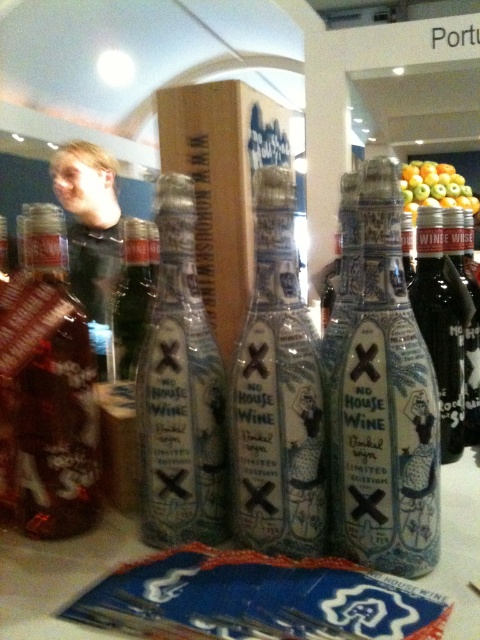
Question: Among these objects, which one is nearest to the camera?

Choices:
 (A) white paper bottle at center
 (B) matte black bottle at center
 (C) translucent glass bottle at center

Answer: (A)

Question: Among these objects, which one is nearest to the camera?

Choices:
 (A) translucent glass bottle at center
 (B) white paper bottle at center
 (C) matte black bottle at center

Answer: (B)

Question: Does black glass bottle at right appear on the left side of matte glass bottle at center?

Choices:
 (A) no
 (B) yes

Answer: (A)

Question: Can you confirm if translucent glass bottle at center is wider than black glass bottle at right?

Choices:
 (A) no
 (B) yes

Answer: (A)

Question: Considering the relative positions of white paper bottle at center and black glass bottle at right in the image provided, where is white paper bottle at center located with respect to black glass bottle at right?

Choices:
 (A) below
 (B) above

Answer: (A)

Question: Among these objects, which one is nearest to the camera?

Choices:
 (A) black glass bottle at right
 (B) matte ceramic bottle at center

Answer: (B)